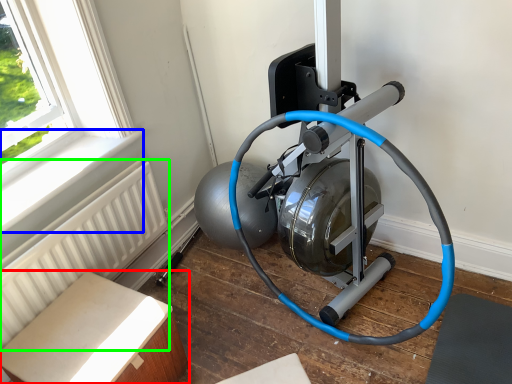
Question: Estimate the real-world distances between objects in this image. Which object is farther from furniture (highlighted by a red box), window sill (highlighted by a blue box) or radiator (highlighted by a green box)?

Choices:
 (A) window sill
 (B) radiator

Answer: (A)